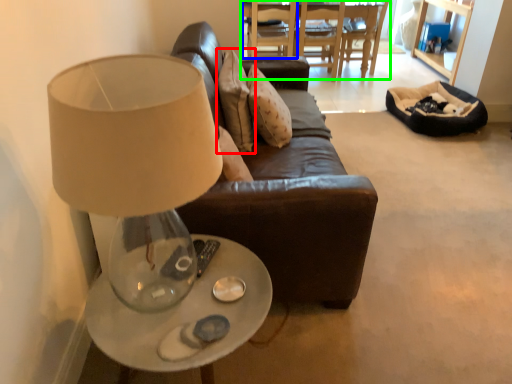
Question: Which is nearer to the pillow (highlighted by a red box)? chair (highlighted by a blue box) or table (highlighted by a green box).

Choices:
 (A) chair
 (B) table

Answer: (A)